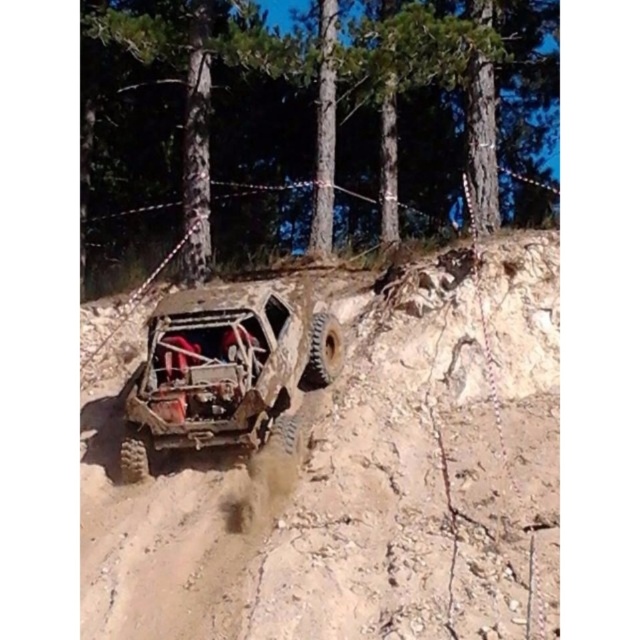
From the picture: Who is positioned more to the left, dusty brown terrain at center or rusty metal jeep at center?

rusty metal jeep at center is more to the left.

Which is above, dusty brown terrain at center or rusty metal jeep at center?

rusty metal jeep at center is higher up.

You are a GUI agent. You are given a task and a screenshot of the screen. Output one action in this format:
    pyautogui.click(x=<x>, y=<y>)
    Task: Click on the dusty brown terrain at center
    
    Given the screenshot: What is the action you would take?
    pyautogui.click(x=352, y=481)